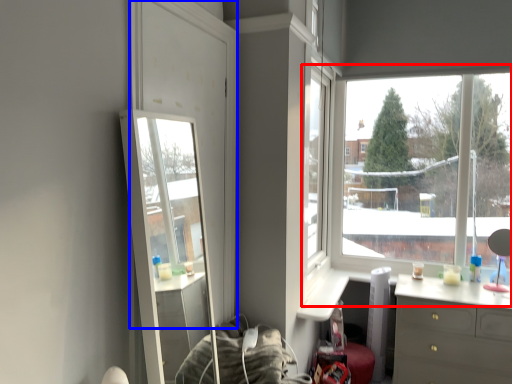
Question: Among these objects, which one is farthest to the camera, window (highlighted by a red box) or glass door (highlighted by a blue box)?

Choices:
 (A) window
 (B) glass door

Answer: (A)